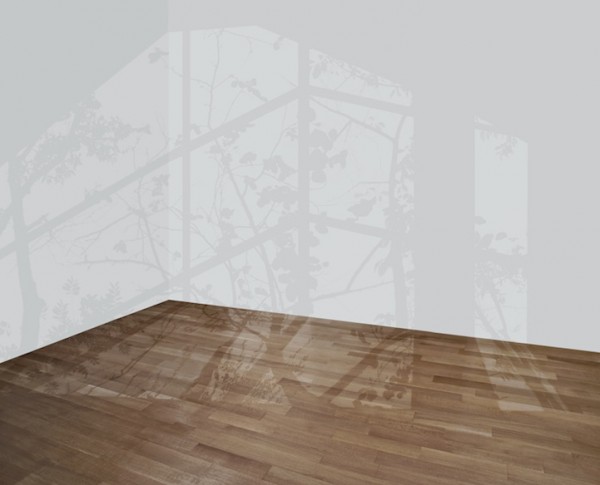
Where is `reflection from window on floor`? The image size is (600, 485). reflection from window on floor is located at coordinates (238, 355).